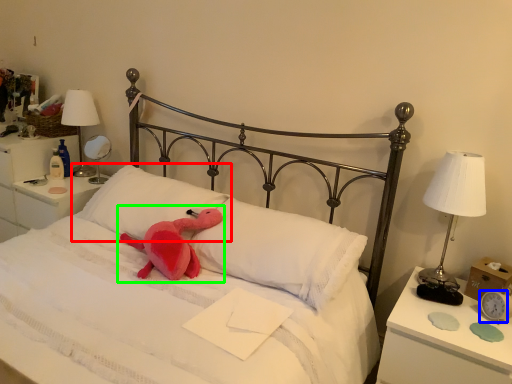
Question: Which is nearer to the pillow (highlighted by a red box)? clock (highlighted by a blue box) or baby elephant (highlighted by a green box).

Choices:
 (A) clock
 (B) baby elephant

Answer: (B)